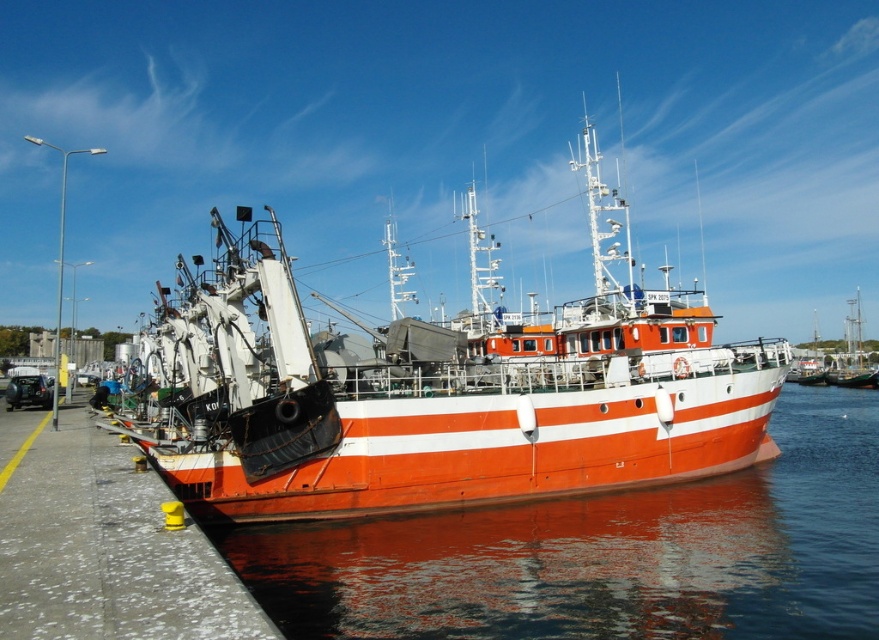
Question: Can you confirm if orange matte boat at center is positioned below glossy water at lower right?

Choices:
 (A) yes
 (B) no

Answer: (B)

Question: Which point appears farthest from the camera in this image?

Choices:
 (A) (848, 538)
 (B) (605, 280)

Answer: (B)

Question: Does orange matte boat at center appear over glossy water at lower right?

Choices:
 (A) yes
 (B) no

Answer: (A)

Question: Which object appears farthest from the camera in this image?

Choices:
 (A) glossy water at lower right
 (B) orange matte boat at center

Answer: (B)

Question: Does orange matte boat at center appear on the right side of glossy water at lower right?

Choices:
 (A) yes
 (B) no

Answer: (B)